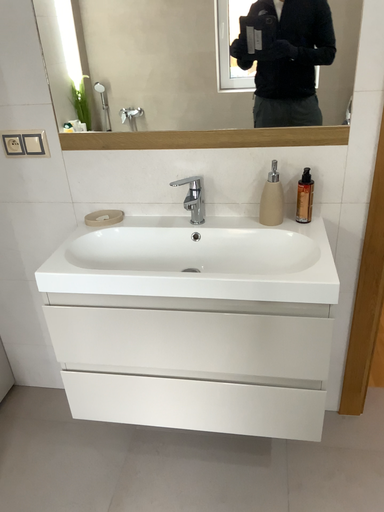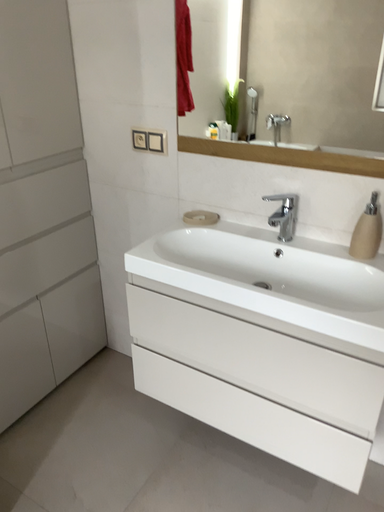
Question: Which way did the camera rotate in the video?

Choices:
 (A) rotated left
 (B) rotated right

Answer: (A)